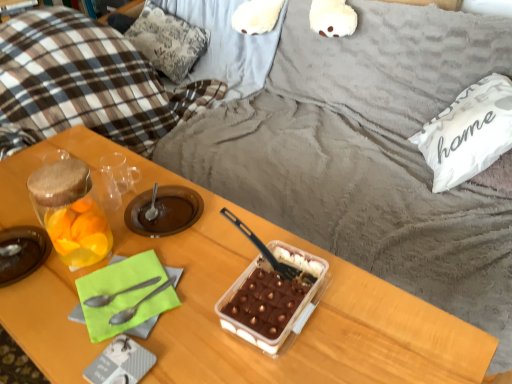
Locate an element on the screen. free location to the right of translucent plastic tray at center, the first snack when ordered from right to left is located at coordinates (371, 314).